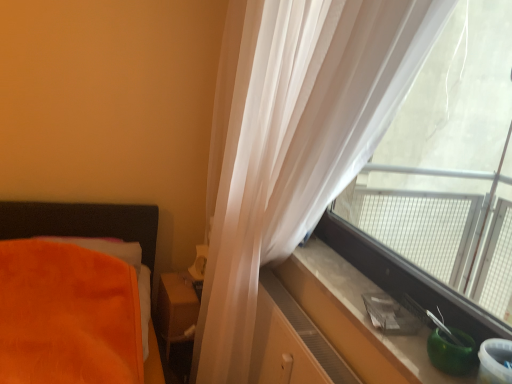
Question: From a real-world perspective, is translucent white curtain at upper right beneath matte brown wooden table at center?

Choices:
 (A) yes
 (B) no

Answer: (B)

Question: From the image's perspective, is translucent white curtain at upper right beneath matte brown wooden table at center?

Choices:
 (A) yes
 (B) no

Answer: (B)

Question: Is translucent white curtain at upper right to the left of matte brown wooden table at center from the viewer's perspective?

Choices:
 (A) no
 (B) yes

Answer: (A)

Question: From a real-world perspective, is translucent white curtain at upper right over matte brown wooden table at center?

Choices:
 (A) yes
 (B) no

Answer: (A)

Question: Is translucent white curtain at upper right positioned beyond the bounds of matte brown wooden table at center?

Choices:
 (A) no
 (B) yes

Answer: (B)

Question: Can you confirm if translucent white curtain at upper right is shorter than matte brown wooden table at center?

Choices:
 (A) no
 (B) yes

Answer: (A)

Question: Is the depth of matte brown wooden table at center greater than that of smooth concrete window sill at right?

Choices:
 (A) yes
 (B) no

Answer: (A)

Question: From a real-world perspective, does matte brown wooden table at center stand above smooth concrete window sill at right?

Choices:
 (A) no
 (B) yes

Answer: (A)

Question: Would you say matte brown wooden table at center contains smooth concrete window sill at right?

Choices:
 (A) no
 (B) yes

Answer: (A)

Question: Considering the relative sizes of matte brown wooden table at center and smooth concrete window sill at right in the image provided, is matte brown wooden table at center taller than smooth concrete window sill at right?

Choices:
 (A) yes
 (B) no

Answer: (A)

Question: From the image's perspective, is matte brown wooden table at center below smooth concrete window sill at right?

Choices:
 (A) no
 (B) yes

Answer: (B)

Question: From the image's perspective, is matte brown wooden table at center located above smooth concrete window sill at right?

Choices:
 (A) yes
 (B) no

Answer: (B)

Question: From the image's perspective, is matte wood dresser at lower right under transparent plastic window at right?

Choices:
 (A) yes
 (B) no

Answer: (A)